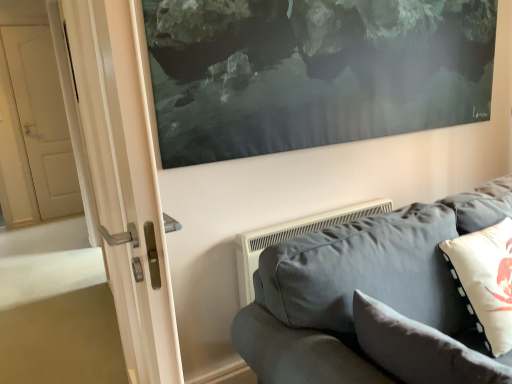
Question: From the image's perspective, would you say soft gray cushion at lower right, which is the first pillow from left to right, is positioned over velvet gray couch at lower right?

Choices:
 (A) no
 (B) yes

Answer: (B)

Question: Can you confirm if soft gray cushion at lower right, which is counted as the 2th pillow, starting from the right, is positioned to the right of velvet gray couch at lower right?

Choices:
 (A) yes
 (B) no

Answer: (B)

Question: Is soft gray cushion at lower right, which is counted as the 2th pillow, starting from the right, oriented away from velvet gray couch at lower right?

Choices:
 (A) yes
 (B) no

Answer: (A)

Question: Are soft gray cushion at lower right, which is the first pillow from left to right, and velvet gray couch at lower right far apart?

Choices:
 (A) yes
 (B) no

Answer: (B)

Question: Would you say soft gray cushion at lower right, which is the first pillow from left to right, is outside velvet gray couch at lower right?

Choices:
 (A) yes
 (B) no

Answer: (B)

Question: In terms of size, does velvet gray couch at lower right appear bigger or smaller than white matte pillow at right, the second pillow from the left?

Choices:
 (A) big
 (B) small

Answer: (A)

Question: Is velvet gray couch at lower right wider or thinner than white matte pillow at right, the second pillow from the left?

Choices:
 (A) thin
 (B) wide

Answer: (B)

Question: Is velvet gray couch at lower right spatially inside white matte pillow at right, placed as the first pillow when sorted from right to left, or outside of it?

Choices:
 (A) outside
 (B) inside

Answer: (A)

Question: From the image's perspective, is velvet gray couch at lower right above or below white matte pillow at right, the second pillow from the left?

Choices:
 (A) above
 (B) below

Answer: (B)

Question: Would you say soft gray cushion at lower right, which is counted as the 2th pillow, starting from the right, is inside or outside white matte pillow at right, the second pillow from the left?

Choices:
 (A) outside
 (B) inside

Answer: (A)

Question: From the image's perspective, relative to white matte pillow at right, placed as the first pillow when sorted from right to left, is soft gray cushion at lower right, which is the first pillow from left to right, above or below?

Choices:
 (A) below
 (B) above

Answer: (A)

Question: Considering their positions, is soft gray cushion at lower right, which is the first pillow from left to right, located in front of or behind white matte pillow at right, the second pillow from the left?

Choices:
 (A) front
 (B) behind

Answer: (A)

Question: Is soft gray cushion at lower right, which is the first pillow from left to right, wider or thinner than white matte pillow at right, placed as the first pillow when sorted from right to left?

Choices:
 (A) thin
 (B) wide

Answer: (A)

Question: Is velvet gray couch at lower right bigger or smaller than soft gray cushion at lower right, which is the first pillow from left to right?

Choices:
 (A) small
 (B) big

Answer: (B)

Question: In the image, is velvet gray couch at lower right on the left side or the right side of soft gray cushion at lower right, which is counted as the 2th pillow, starting from the right?

Choices:
 (A) right
 (B) left

Answer: (A)